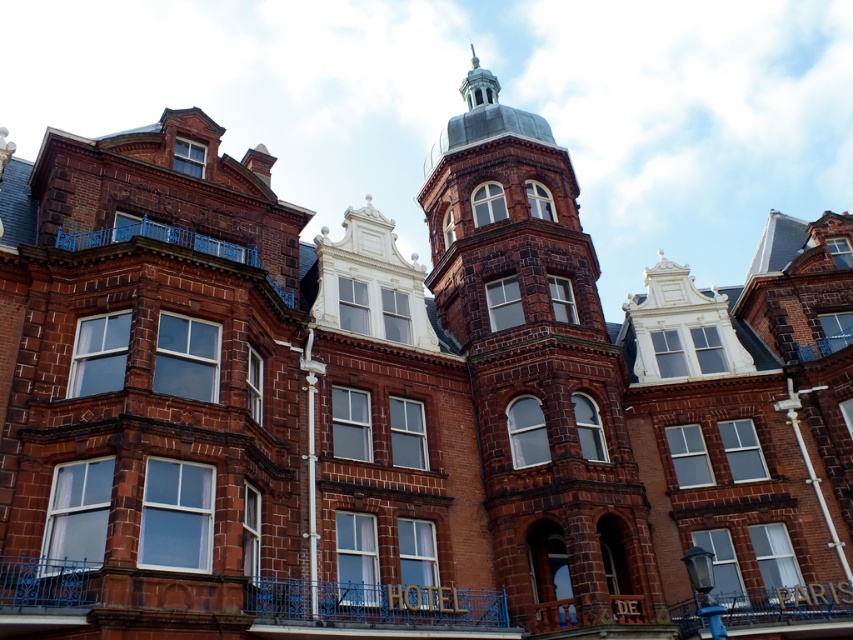
You are an architect evaluating the building. Based on the image, which object is wider between the smooth brick bell tower at center and the polished silver spire at upper center?

The smooth brick bell tower at center is wider than the polished silver spire at upper center according to the description.

You are an architect inspecting the building from the front. You notice the smooth brick bell tower at center and the polished silver spire at upper center. Which object is located higher up on the building?

The polished silver spire at upper center is located higher up on the building than the smooth brick bell tower at center.